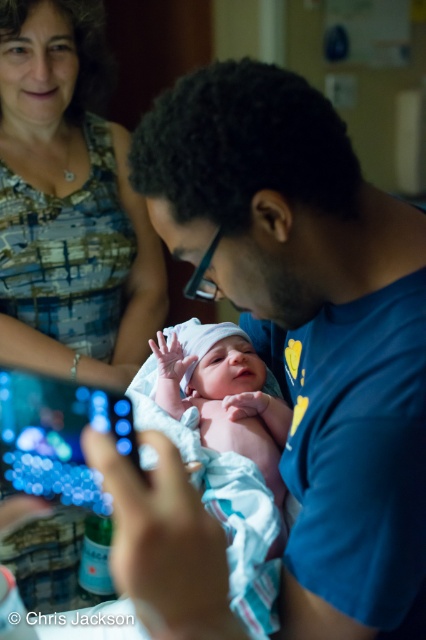
Does point (80, 100) lie behind point (169, 385)?

That is True.

Can you confirm if blue printed fabric at upper left is smaller than white clothed newborn at center?

No, blue printed fabric at upper left is not smaller than white clothed newborn at center.

Identify the location of blue printed fabric at upper left. The height and width of the screenshot is (640, 426). (69, 205).